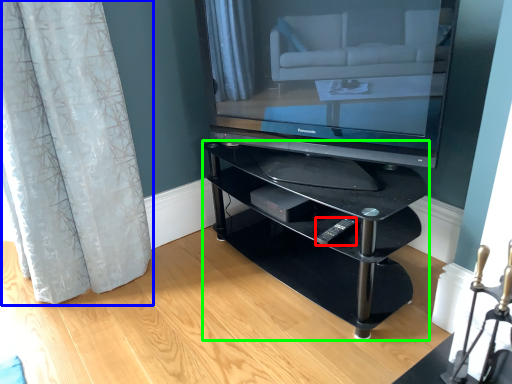
Question: Which object is the farthest from remote (highlighted by a red box)? Choose among these: curtain (highlighted by a blue box) or shelf (highlighted by a green box).

Choices:
 (A) curtain
 (B) shelf

Answer: (A)